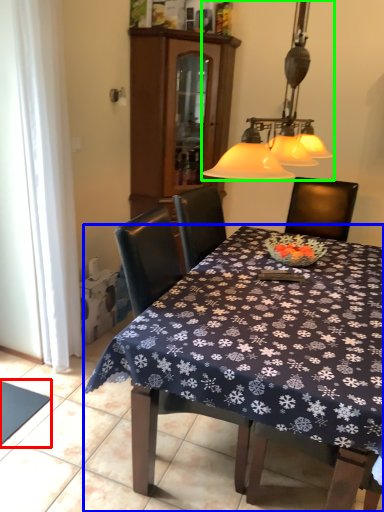
Question: Which object is positioned farthest from tablecloth (highlighted by a red box)? Select from kitchen & dining room table (highlighted by a blue box) and lamp (highlighted by a green box).

Choices:
 (A) kitchen & dining room table
 (B) lamp

Answer: (B)